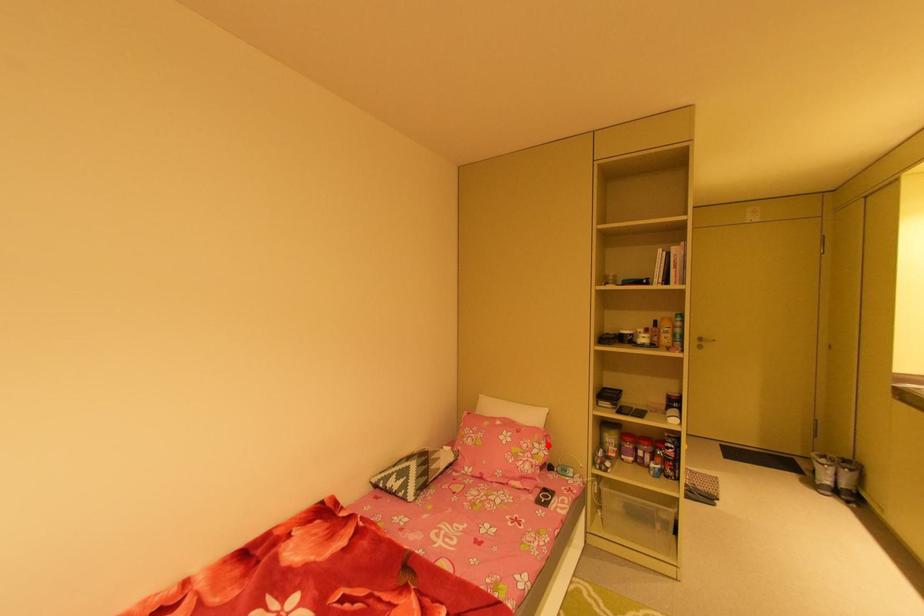
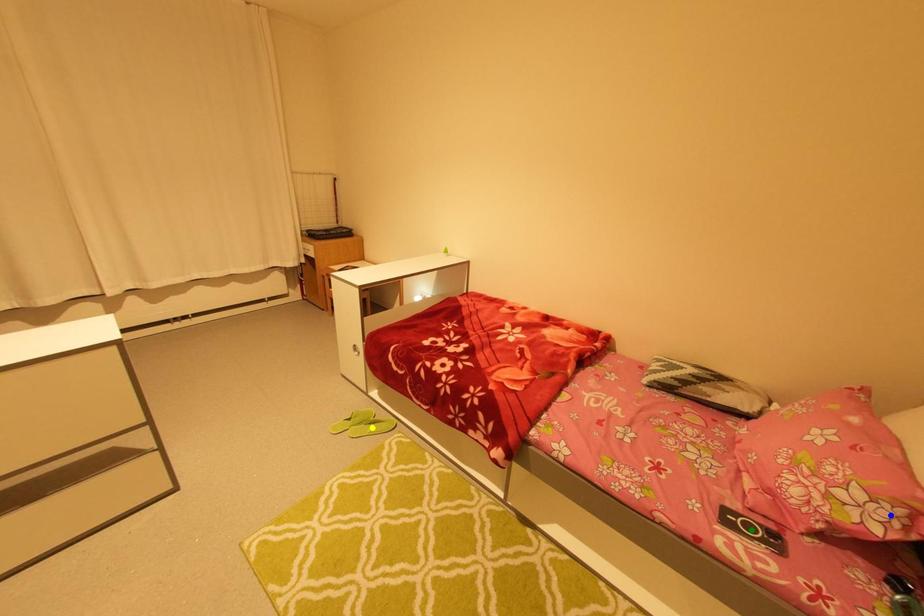
Question: I am providing you with two images of the same scene from different viewpoints. A red point is marked on the first image. You are given multiple points on the second image. Can you choose the point in image 2 that corresponds to the point in image 1?

Choices:
 (A) blue point
 (B) green point
 (C) yellow point

Answer: (A)